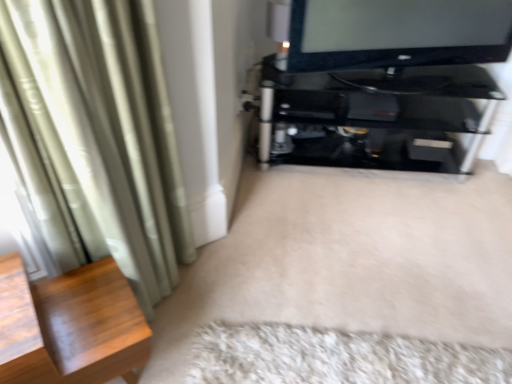
This screenshot has width=512, height=384. Describe the element at coordinates (336, 357) in the screenshot. I see `white fluffy rug at lower center` at that location.

Where is `black glossy television at upper right`? The height and width of the screenshot is (384, 512). black glossy television at upper right is located at coordinates (397, 33).

Identify the location of silky green curtain at left. (96, 136).

You are a GUI agent. You are given a task and a screenshot of the screen. Output one action in this format:
    pyautogui.click(x=<x>, y=<y>)
    Task: Click on the white fluffy rug at lower center
    
    Given the screenshot: What is the action you would take?
    pyautogui.click(x=336, y=357)

Identify the location of shelf above the white fluffy rug at lower center (from the image's perspective). (377, 115).

Looking at this image, is black glass shelf at upper right to the left or to the right of white fluffy rug at lower center in the image?

Clearly, black glass shelf at upper right is on the right of white fluffy rug at lower center in the image.

From a real-world perspective, is black glass shelf at upper right physically above white fluffy rug at lower center?

Yes.

Which of these two, wooden side table at left or white fluffy rug at lower center, is smaller?

white fluffy rug at lower center is smaller.

Is wooden side table at left oriented away from white fluffy rug at lower center?

wooden side table at left does not have its back to white fluffy rug at lower center.

From their relative heights in the image, would you say wooden side table at left is taller or shorter than white fluffy rug at lower center?

In the image, wooden side table at left appears to be taller than white fluffy rug at lower center.

Considering the positions of objects wooden side table at left and white fluffy rug at lower center in the image provided, who is more to the right, wooden side table at left or white fluffy rug at lower center?

white fluffy rug at lower center is more to the right.

Based on the photo, can you confirm if white fluffy rug at lower center is shorter than black glass shelf at upper right?

Yes, white fluffy rug at lower center is shorter than black glass shelf at upper right.

From the picture: Is black glass shelf at upper right at the back of white fluffy rug at lower center?

No, black glass shelf at upper right is not at the back of white fluffy rug at lower center.

Image resolution: width=512 pixels, height=384 pixels. What are the coordinates of `mat in front of the black glass shelf at upper right` in the screenshot? It's located at (336, 357).

Considering the relative positions of white fluffy rug at lower center and black glass shelf at upper right in the image provided, is white fluffy rug at lower center behind black glass shelf at upper right?

That is False.

Looking at the image, does wooden side table at left seem bigger or smaller compared to black glass shelf at upper right?

wooden side table at left is smaller than black glass shelf at upper right.

Which object is wider, wooden side table at left or black glass shelf at upper right?

black glass shelf at upper right is wider.

From the image's perspective, between wooden side table at left and black glass shelf at upper right, which one is located above?

black glass shelf at upper right.

Which object is positioned more to the right, black glossy television at upper right or wooden side table at left?

black glossy television at upper right is more to the right.

Which object is thinner, black glossy television at upper right or wooden side table at left?

black glossy television at upper right is thinner.

Consider the image. Is black glossy television at upper right positioned far away from wooden side table at left?

Absolutely, black glossy television at upper right is distant from wooden side table at left.

Is black glossy television at upper right positioned with its back to wooden side table at left?

That's not correct — black glossy television at upper right is not looking away from wooden side table at left.

How many degrees apart are the facing directions of wooden side table at left and black glossy television at upper right?

They differ by 21.2 degrees in their facing directions.

Where is `television that is above the wooden side table at left (from the image's perspective)`? This screenshot has width=512, height=384. television that is above the wooden side table at left (from the image's perspective) is located at coordinates (397, 33).

Does wooden side table at left have a greater height compared to black glossy television at upper right?

Correct, wooden side table at left is much taller as black glossy television at upper right.

In terms of size, does wooden side table at left appear bigger or smaller than black glossy television at upper right?

Clearly, wooden side table at left is larger in size than black glossy television at upper right.

Can you confirm if black glass shelf at upper right is wider than silky green curtain at left?

Yes.

This screenshot has width=512, height=384. In order to click on shelf that appears above the silky green curtain at left (from the image's perspective) in this screenshot , I will do `click(377, 115)`.

Is the surface of black glass shelf at upper right in direct contact with silky green curtain at left?

No, black glass shelf at upper right is not making contact with silky green curtain at left.

Locate an element on the screen. shelf that is above the white fluffy rug at lower center (from the image's perspective) is located at coordinates (377, 115).

Where is `mat on the right of wooden side table at left`? The height and width of the screenshot is (384, 512). mat on the right of wooden side table at left is located at coordinates point(336,357).

Which object lies nearer to the anchor point silky green curtain at left, white fluffy rug at lower center or black glossy television at upper right?

white fluffy rug at lower center is positioned closer to the anchor silky green curtain at left.

Looking at the image, which one is located closer to black glossy television at upper right, black glass shelf at upper right or silky green curtain at left?

black glass shelf at upper right.

From the image, which object appears to be farther from wooden side table at left, black glass shelf at upper right or white fluffy rug at lower center?

The object further to wooden side table at left is black glass shelf at upper right.

Consider the image. Considering their positions, is wooden side table at left positioned closer to black glossy television at upper right than silky green curtain at left?

Among the two, silky green curtain at left is located nearer to black glossy television at upper right.

Estimate the real-world distances between objects in this image. Which object is further from black glass shelf at upper right, silky green curtain at left or wooden side table at left?

wooden side table at left is positioned further to the anchor black glass shelf at upper right.

Considering their positions, is wooden side table at left positioned further to silky green curtain at left than white fluffy rug at lower center?

Based on the image, white fluffy rug at lower center appears to be further to silky green curtain at left.

When comparing their distances from white fluffy rug at lower center, does wooden side table at left or black glass shelf at upper right seem further?

The object further to white fluffy rug at lower center is black glass shelf at upper right.

When comparing their distances from black glossy television at upper right, does white fluffy rug at lower center or wooden side table at left seem further?

The object further to black glossy television at upper right is wooden side table at left.

Locate an element on the screen. The height and width of the screenshot is (384, 512). furniture between black glossy television at upper right and white fluffy rug at lower center in the up-down direction is located at coordinates (83, 329).

Where is `shelf between wooden side table at left and black glossy television at upper right`? shelf between wooden side table at left and black glossy television at upper right is located at coordinates (377, 115).

Identify the location of mat situated between wooden side table at left and black glass shelf at upper right from left to right. (336, 357).

In order to click on curtain between wooden side table at left and black glossy television at upper right from left to right in this screenshot , I will do `click(96, 136)`.